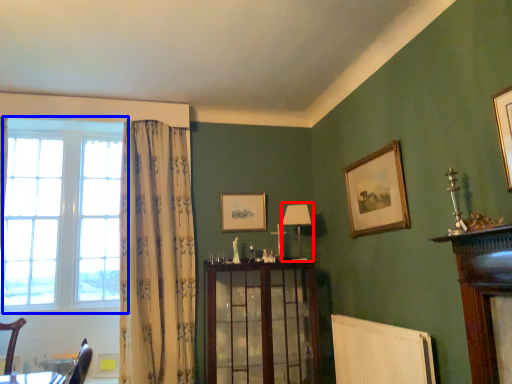
Question: Which object is further to the camera taking this photo, lamp (highlighted by a red box) or window (highlighted by a blue box)?

Choices:
 (A) lamp
 (B) window

Answer: (A)